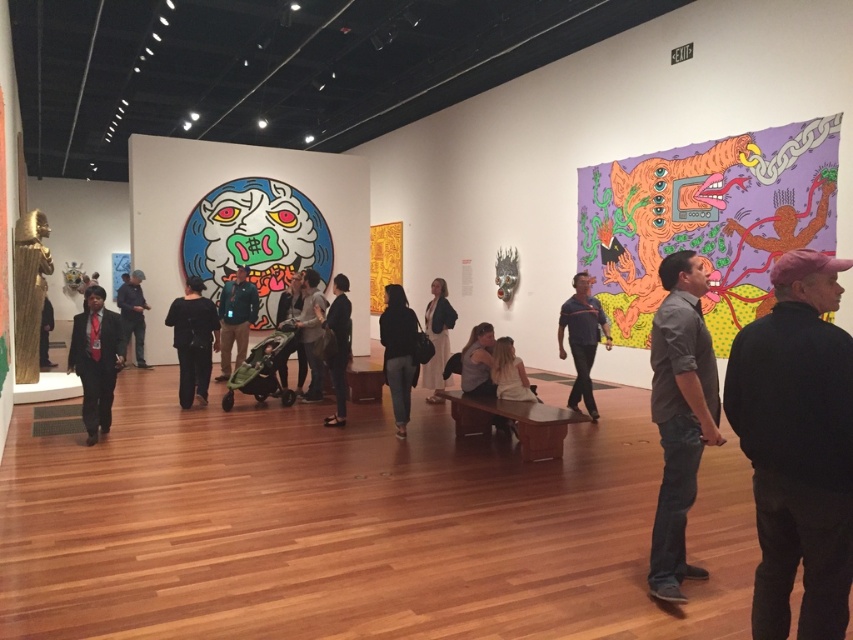
You are a fashion designer observing two outfits displayed in the center of an art gallery. The gray cotton shirt at center and the dark gray suit at center are both on mannequins. Which outfit takes up more space on the display stand?

The dark gray suit at center takes up more space on the display stand because it is larger than the gray cotton shirt at center.

Consider the image. You are a fashion designer observing the matte black suit at left and the light gray cotton shirt at center in the art gallery. Which clothing item takes up more space in the room?

The light gray cotton shirt at center occupies more space than the matte black suit at left.

You are an artist trying to hang a new painting that requires a hook at exactly the same height as the bottom of the black matte jacket at center. Can you use the dark blue shirt at center as a reference point to ensure the hook is placed correctly?

The black matte jacket at center is not as tall as the dark blue shirt at center, so the hook should be placed lower than the bottom of the dark blue shirt at center to match the height of the black matte jacket at center.